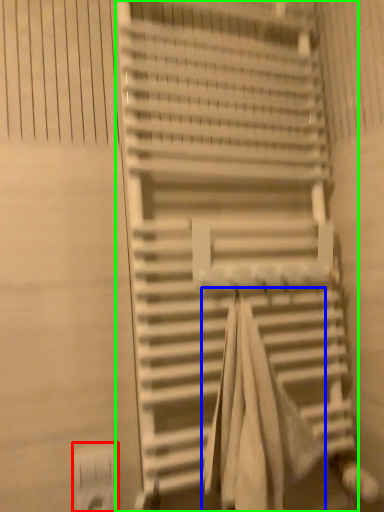
Question: Which is nearer to the electric outlet (highlighted by a red box)? beach towel (highlighted by a blue box) or stairs (highlighted by a green box).

Choices:
 (A) beach towel
 (B) stairs

Answer: (A)